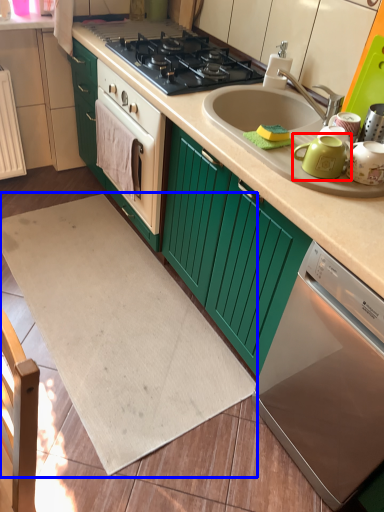
Question: Among these objects, which one is nearest to the camera, teal (highlighted by a red box) or wide (highlighted by a blue box)?

Choices:
 (A) teal
 (B) wide

Answer: (A)